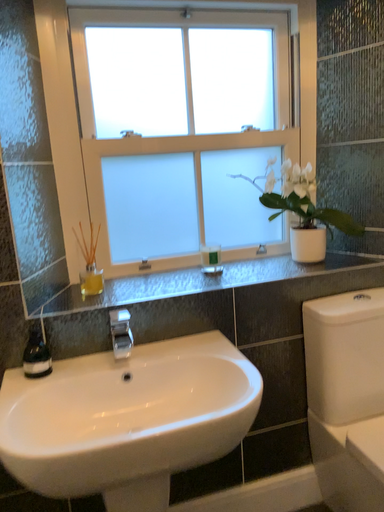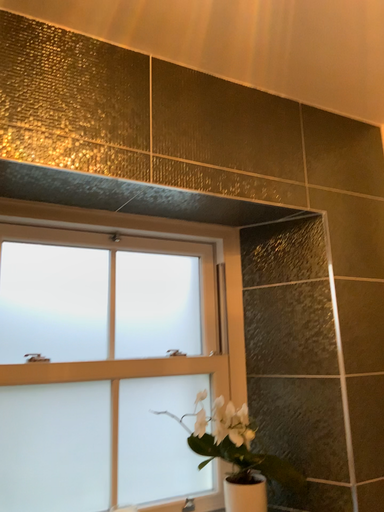
Question: How did the camera likely rotate when shooting the video?

Choices:
 (A) rotated downward
 (B) rotated upward

Answer: (B)